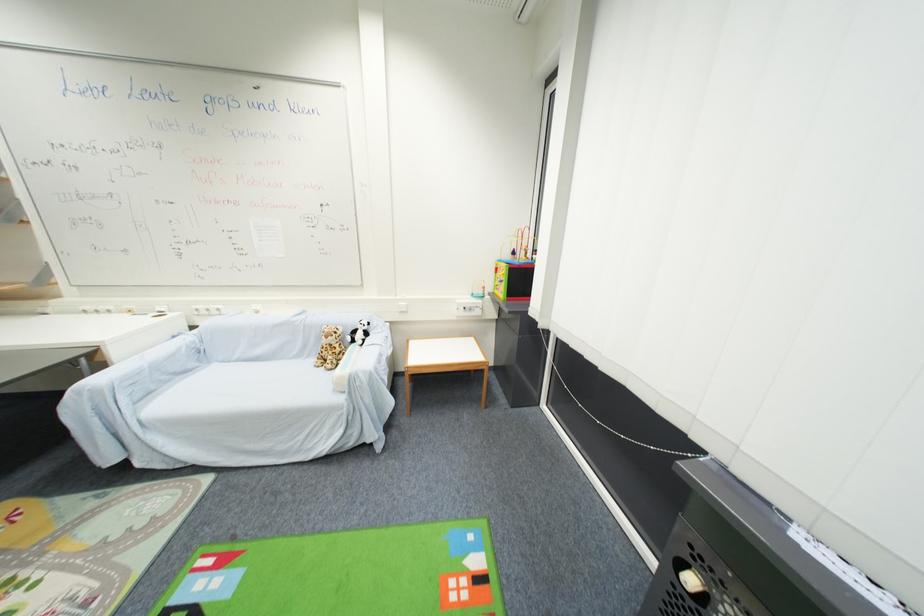
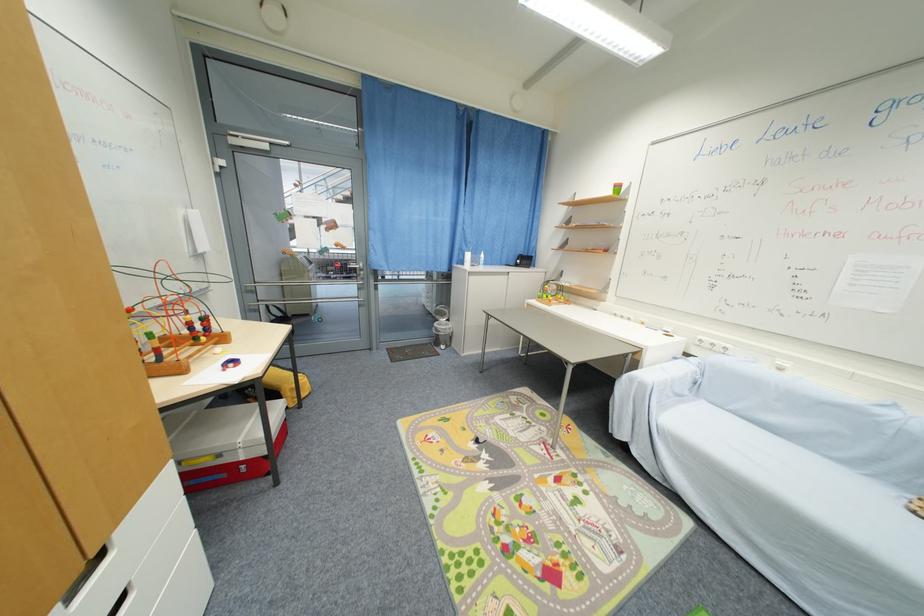
The point at (x=179, y=339) is marked in the first image. Where is the corresponding point in the second image?

(681, 360)